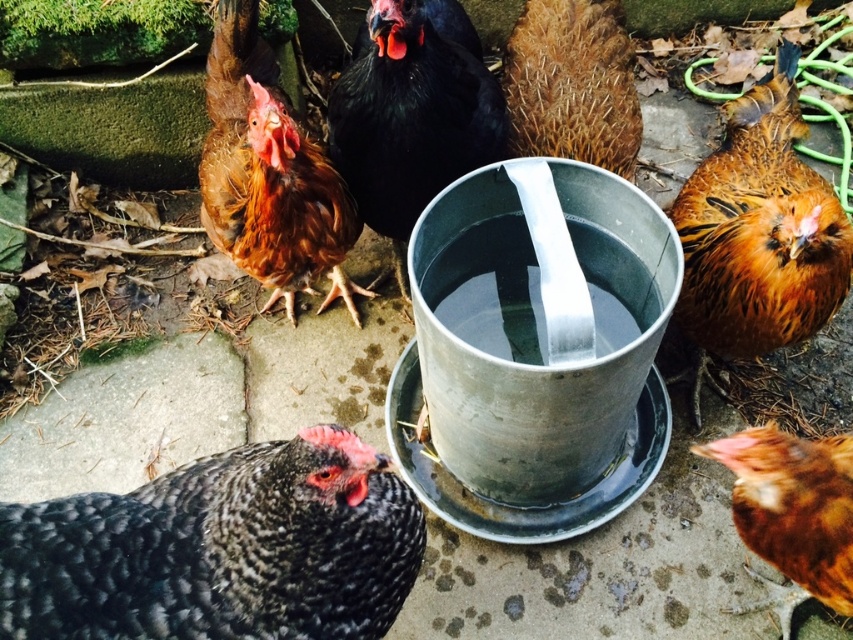
Based on the scene description, where is the speckled black chicken at center located in terms of its 2D coordinates?

The speckled black chicken at center is located at the 2D coordinates of point (219, 548).

You are standing at the origin point and looking towards the metal waterer. There are two points marked in the image. Which point, point (148, 604) or point (750, 435), is closer to you?

Point (148, 604) is closer to you because it is in front of point (750, 435).